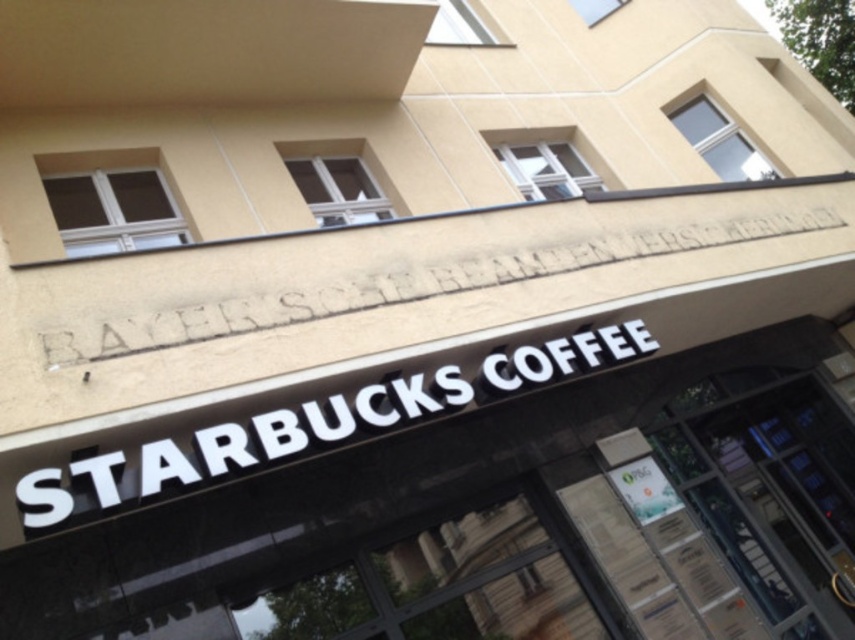
Is transparent glass door at center further to the viewer compared to white plastic sign at center?

That is True.

Which is behind, point (848, 556) or point (304, 451)?

The point (848, 556) is more distant.

Identify the location of transparent glass door at center. click(x=770, y=490).

Between transparent glass door at center and white stone engraving at center, which one has less height?

white stone engraving at center is shorter.

Between transparent glass door at center and white stone engraving at center, which one appears on the left side from the viewer's perspective?

white stone engraving at center is more to the left.

Find the location of a particular element. transparent glass door at center is located at coordinates (770, 490).

Locate an element on the screen. The image size is (855, 640). transparent glass door at center is located at coordinates (770, 490).

Does white plastic sign at center have a greater height compared to white stone engraving at center?

Correct, white plastic sign at center is much taller as white stone engraving at center.

Does white plastic sign at center appear over white stone engraving at center?

No.

Looking at this image, who is more forward, (386,401) or (476,273)?

Point (386,401)

The width and height of the screenshot is (855, 640). Find the location of `white plastic sign at center`. white plastic sign at center is located at coordinates (311, 426).